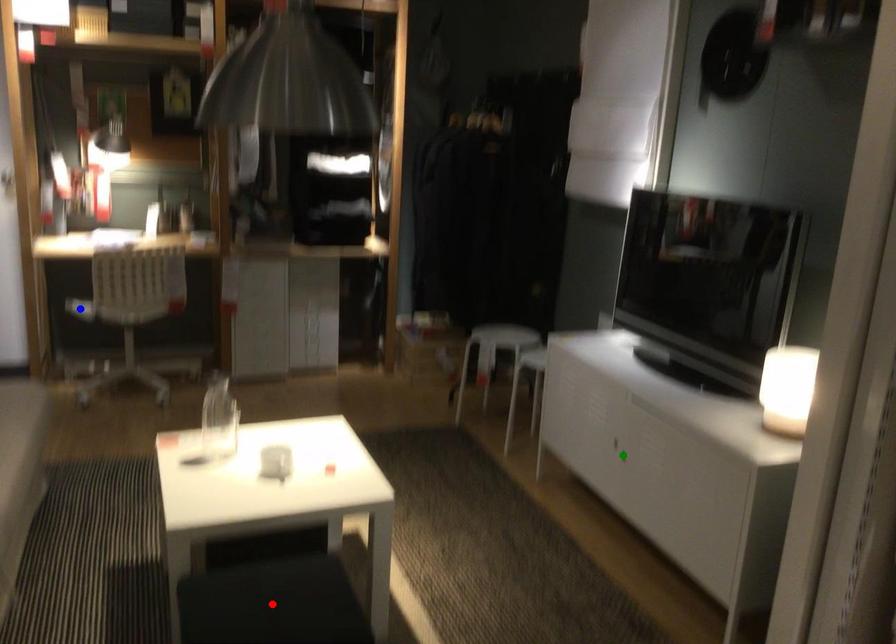
Order these from nearest to farthest:
- green point
- blue point
- red point

1. red point
2. green point
3. blue point